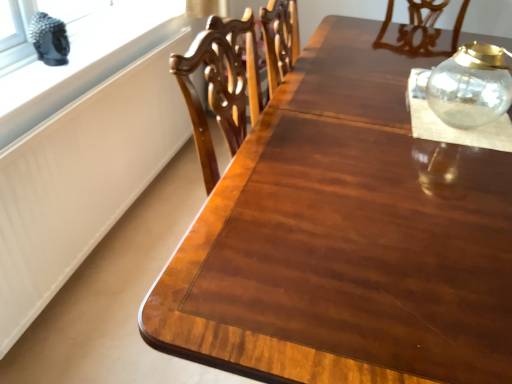
Question: From the image's perspective, is transparent glass jar at upper right above or below white matte window sill at upper left?

Choices:
 (A) below
 (B) above

Answer: (A)

Question: Considering the positions of point (458, 77) and point (142, 11), is point (458, 77) closer or farther from the camera than point (142, 11)?

Choices:
 (A) closer
 (B) farther

Answer: (A)

Question: Which object is the closest to the white matte window sill at upper left?

Choices:
 (A) transparent glass jar at upper right
 (B) transparent glass jar at upper right

Answer: (B)

Question: Estimate the real-world distances between objects in this image. Which object is closer to the transparent glass jar at upper right?

Choices:
 (A) white matte window sill at upper left
 (B) transparent glass jar at upper right

Answer: (B)